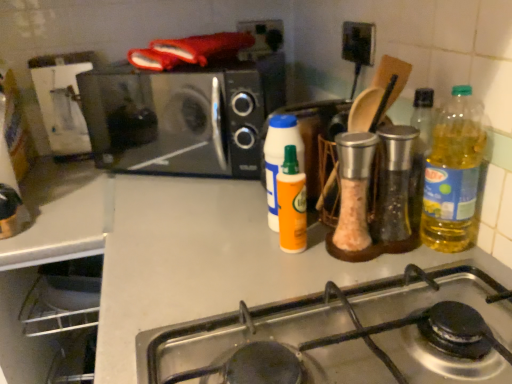
Find the location of a particular element. This screenshot has height=384, width=512. free location to the left of orange matte spray can at center, acting as the second bottle starting from the left is located at coordinates 197,253.